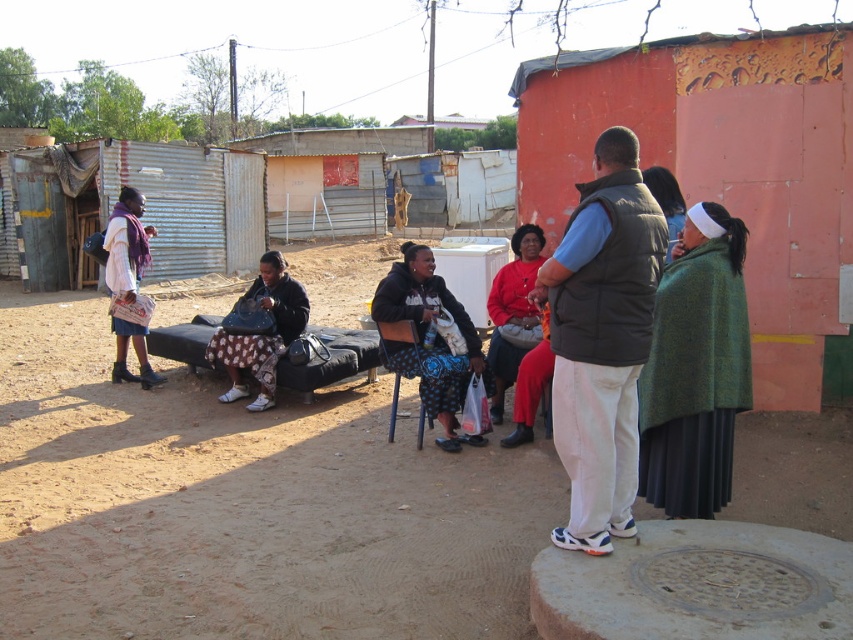
You are a delivery person who needs to retrieve an item from the dull black fabric bag at center. However, you notice the matte purple scarf at left is blocking your access. Can you easily reach the bag without moving the scarf?

The dull black fabric bag at center is positioned under the matte purple scarf at left, so you can easily reach it without moving the scarf since it is located beneath it.

Consider the image. You are standing at point (142, 228) and want to walk to the man on the concrete platform. Is the point (270, 369) between you and the man?

Yes, point (270, 369) is between you and the man on the concrete platform because it is in front of point (142, 228) where you are standing.

You are a photographer trying to capture both the dark gray vest at center and the matte black jacket at center in a single frame. Given their sizes, which object should you focus on to ensure both fit comfortably in the photo?

Since the dark gray vest at center occupies less space than the matte black jacket at center, you should focus on the matte black jacket at center to ensure both fit comfortably in the photo.